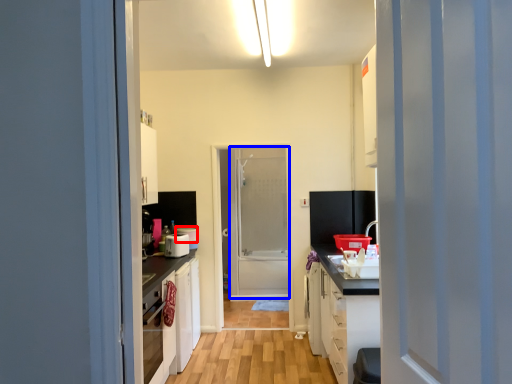
Question: Which point is closer to the camera, appliance (highlighted by a red box) or screen door (highlighted by a blue box)?

Choices:
 (A) appliance
 (B) screen door

Answer: (A)